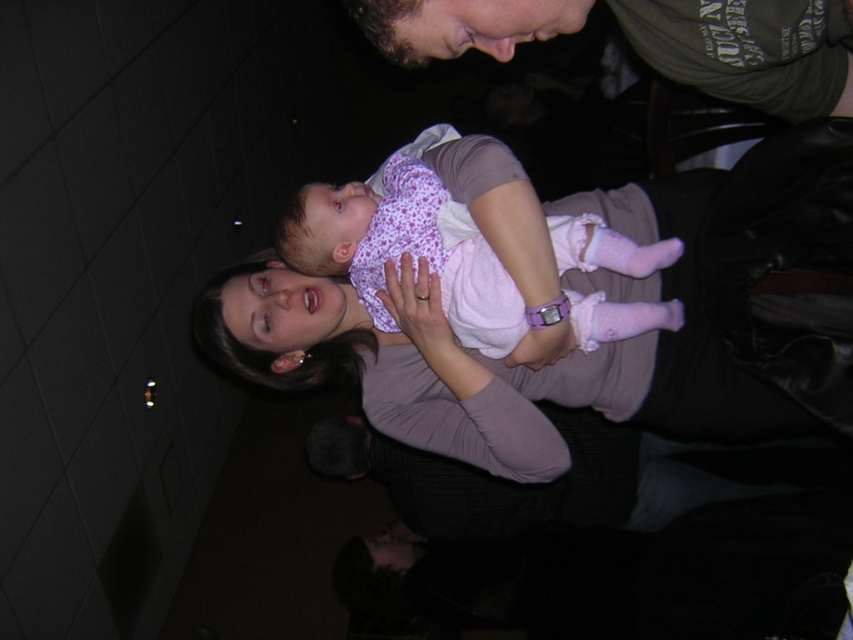
You are a photographer trying to frame a rotated image. The pink fabric baby at center and the purple matte arm at center are in the shot. Since the image is rotated, you need to adjust your focus. Which object is wider in the rotated image?

The pink fabric baby at center is wider than the purple matte arm at center in the rotated image.

You are a photographer trying to capture the pink fabric baby at center and the dark gray sweater at center in a vertical composition. Since the image is rotated sideways, you need to adjust your camera to align with the original orientation. Considering their widths, which object should you frame first to ensure both fit in the frame?

The pink fabric baby at center is thinner than the dark gray sweater at center, so you should frame the pink fabric baby at center first to ensure there is enough space for the wider dark gray sweater at center in the vertical composition.